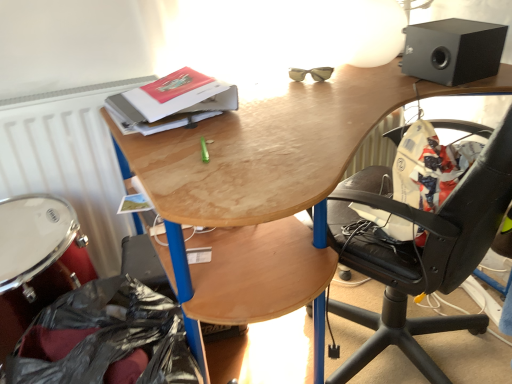
Question: From a real-world perspective, is black matte speaker at upper right physically located above or below black plastic bag at lower left?

Choices:
 (A) above
 (B) below

Answer: (A)

Question: In terms of size, does black matte speaker at upper right appear bigger or smaller than black plastic bag at lower left?

Choices:
 (A) small
 (B) big

Answer: (A)

Question: Considering the real-world distances, which object is farthest from the black matte speaker at upper right?

Choices:
 (A) black plastic bag at lower left
 (B) white matte radiator at left
 (C) wooden desk at upper center
 (D) hardcover book at upper center
 (E) white polished drum at lower left

Answer: (E)

Question: Considering the real-world distances, which object is farthest from the black matte speaker at upper right?

Choices:
 (A) white matte radiator at left
 (B) hardcover book at upper center
 (C) wooden desk at upper center
 (D) black plastic bag at lower left
 (E) white polished drum at lower left

Answer: (E)